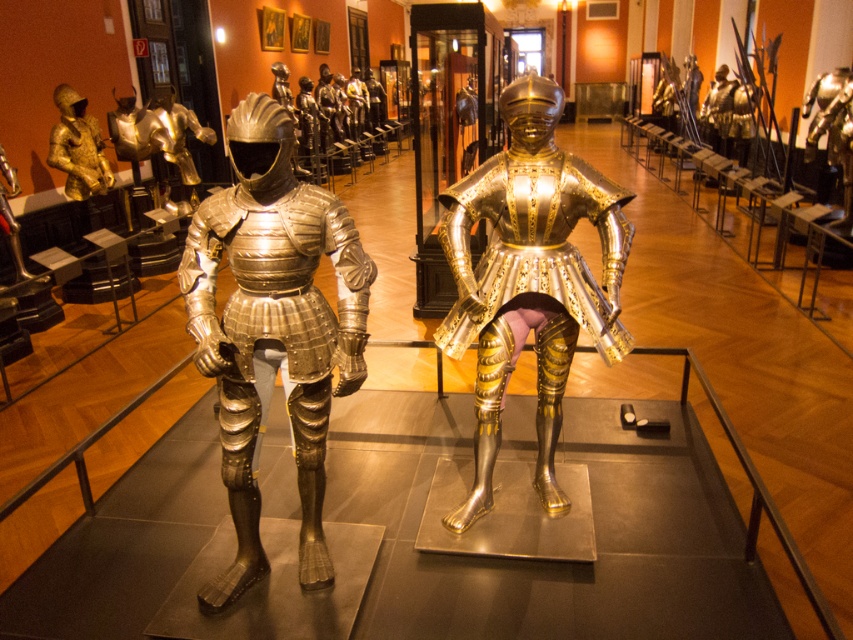
Consider the image. Between shiny silver armor at center and gold plated armor at left, which one appears on the right side from the viewer's perspective?

From the viewer's perspective, shiny silver armor at center appears more on the right side.

Looking at this image, between shiny silver armor at center and gold plated armor at left, which one has more height?

shiny silver armor at center is taller.

Describe the element at coordinates (160, 136) in the screenshot. I see `shiny silver armor at center` at that location.

I want to click on shiny silver armor at center, so click(160, 136).

Which is below, gold plated armor at center or shiny silver armor at center?

gold plated armor at center is lower down.

Between point (485, 369) and point (177, 113), which one is positioned in front?

Point (485, 369) is in front.

Image resolution: width=853 pixels, height=640 pixels. I want to click on gold plated armor at center, so click(x=529, y=280).

Is polished silver armor at center to the left of shiny silver armor at center from the viewer's perspective?

In fact, polished silver armor at center is to the right of shiny silver armor at center.

Does point (349, 260) lie in front of point (148, 108)?

Yes.

The image size is (853, 640). Describe the element at coordinates (273, 328) in the screenshot. I see `polished silver armor at center` at that location.

This screenshot has width=853, height=640. I want to click on polished silver armor at center, so click(273, 328).